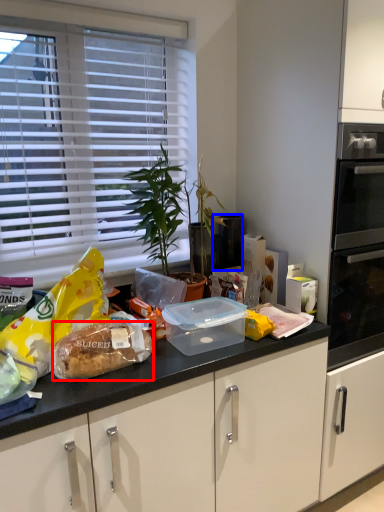
Question: Which point is further to the camera, food (highlighted by a red box) or appliance (highlighted by a blue box)?

Choices:
 (A) food
 (B) appliance

Answer: (B)